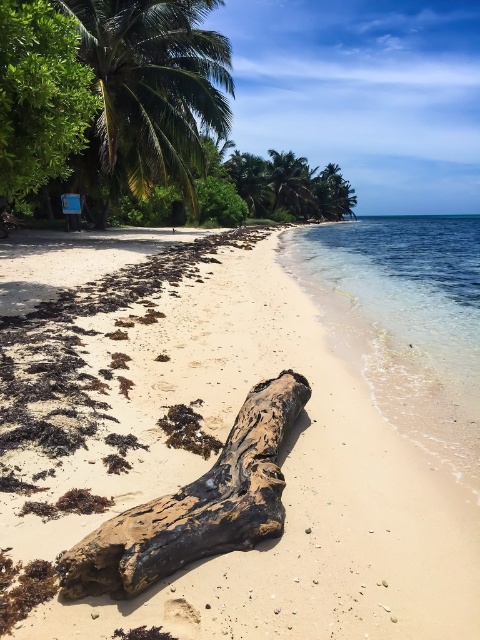
Question: Where is green leafy palm tree at upper left located in relation to green leafy palm tree at upper center in the image?

Choices:
 (A) left
 (B) right

Answer: (A)

Question: Among these points, which one is farthest from the camera?

Choices:
 (A) (310, 172)
 (B) (224, 317)
 (C) (168, 88)
 (D) (225, 452)

Answer: (A)

Question: Which point is farther from the camera taking this photo?

Choices:
 (A) (123, 560)
 (B) (104, 381)
 (C) (190, 108)
 (D) (286, 163)

Answer: (D)

Question: Can you confirm if brown sandy beach at center is positioned below green leafy palm tree at upper center?

Choices:
 (A) yes
 (B) no

Answer: (A)

Question: Does brown sandy beach at center have a larger size compared to green leafy palm tree at upper left?

Choices:
 (A) yes
 (B) no

Answer: (B)

Question: Among these objects, which one is nearest to the camera?

Choices:
 (A) green leafy palm tree at upper center
 (B) brown sandy beach at center
 (C) green leafy palm tree at upper left

Answer: (B)